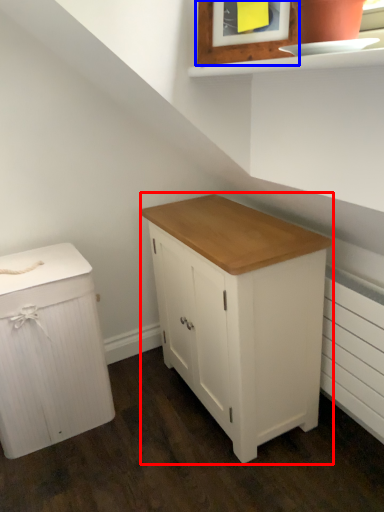
Question: Which of the following is the farthest to the observer, chest of drawers (highlighted by a red box) or picture frame (highlighted by a blue box)?

Choices:
 (A) chest of drawers
 (B) picture frame

Answer: (A)